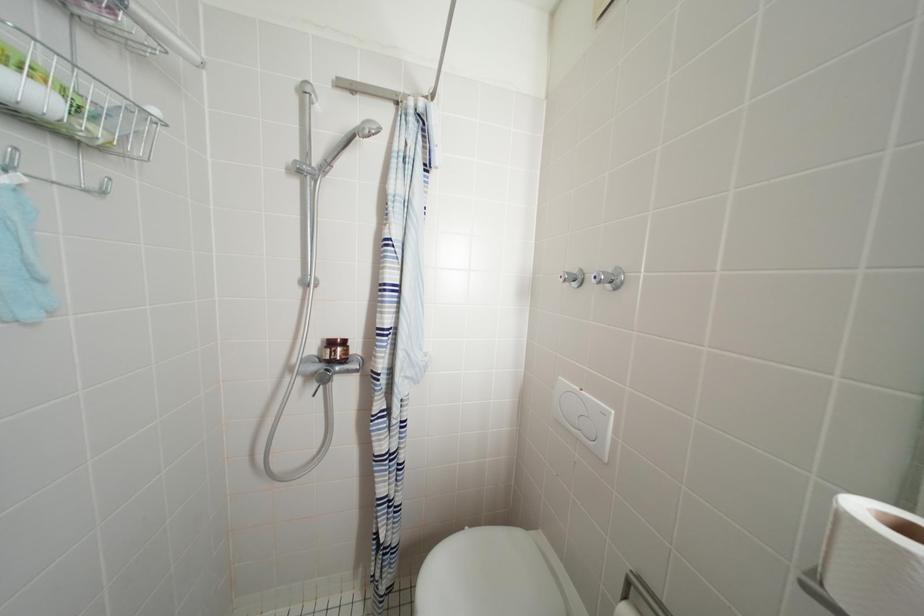
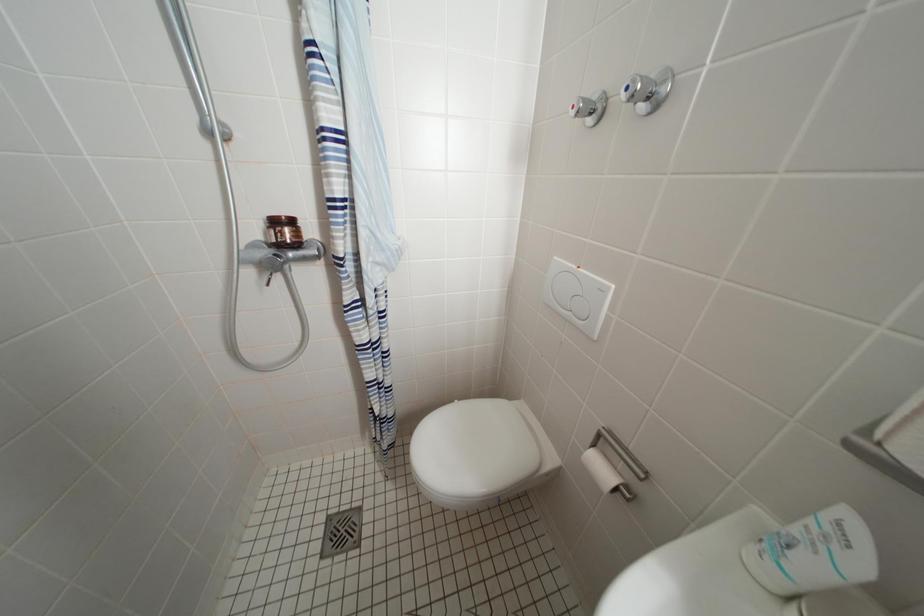
Question: Based on the continuous images, in which direction is the camera rotating? Reply with the corresponding letter.

Choices:
 (A) Left
 (B) Right
 (C) Up
 (D) Down

Answer: (D)